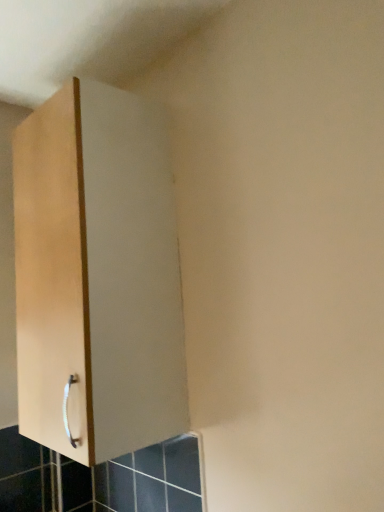
This screenshot has height=512, width=384. In order to click on matte wood cabinet at left in this screenshot , I will do `click(97, 275)`.

Image resolution: width=384 pixels, height=512 pixels. What do you see at coordinates (97, 275) in the screenshot?
I see `matte wood cabinet at left` at bounding box center [97, 275].

Find the location of `matte wood cabinet at left`. matte wood cabinet at left is located at coordinates (97, 275).